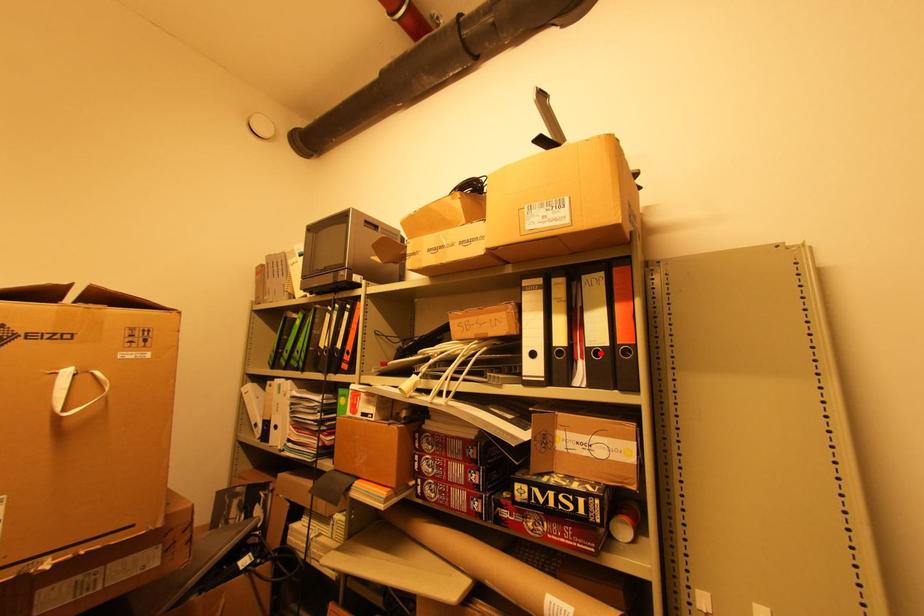
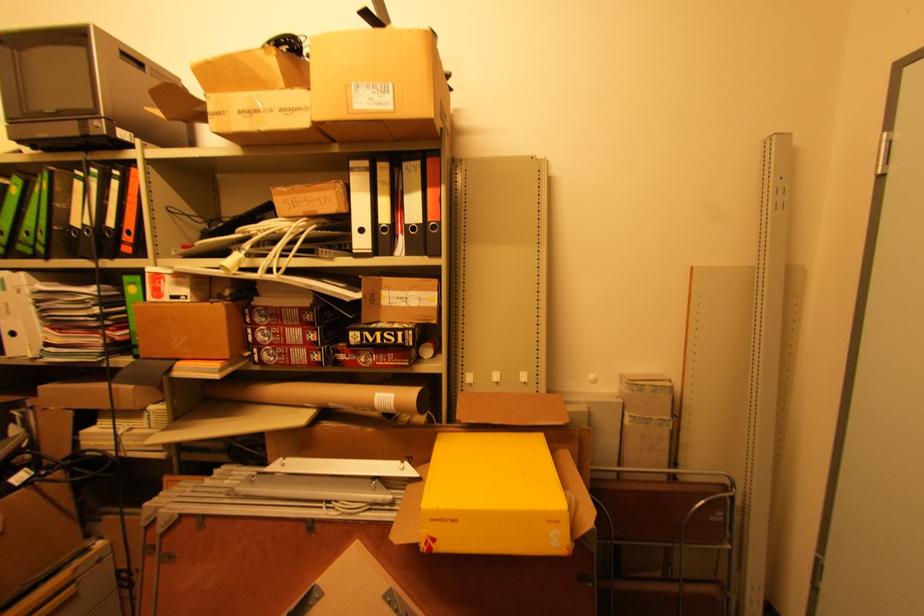
Find the pixel in the second image that matches the highlighted location in the first image.

(417, 229)